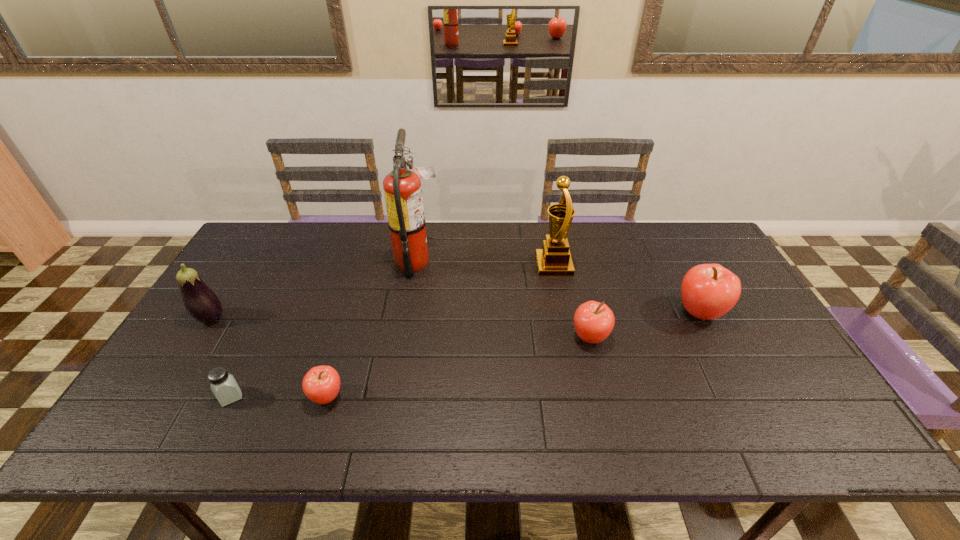
Where is `free space between the second tallest apple and the eggplant`? This screenshot has width=960, height=540. free space between the second tallest apple and the eggplant is located at coordinates (400, 328).

The image size is (960, 540). Identify the location of vacant space that is in between the saltshaker and the eggplant. (221, 357).

Where is `object that stands as the third closest to the award`? Image resolution: width=960 pixels, height=540 pixels. object that stands as the third closest to the award is located at coordinates (402, 188).

Find the location of a particular element. object that is the third closest to the rightmost apple is located at coordinates (402, 188).

The image size is (960, 540). I want to click on the closest apple to the tallest apple, so coord(593,321).

You are a GUI agent. You are given a task and a screenshot of the screen. Output one action in this format:
    pyautogui.click(x=<x>, y=<y>)
    Task: Click on the apple that stands as the third closest to the award
    This screenshot has width=960, height=540.
    Given the screenshot: What is the action you would take?
    pyautogui.click(x=321, y=384)

The image size is (960, 540). In order to click on free spot that satisfies the following two spatial constraints: 1. from the nozzle of the tallest object; 2. on the front side of the shortest apple in this screenshot , I will do `click(395, 397)`.

I want to click on vacant area in the image that satisfies the following two spatial constraints: 1. from the nozzle of the tallest apple; 2. on the right side of the tallest object, so click(409, 313).

Identify the location of blank space that satisfies the following two spatial constraints: 1. on the back side of the rightmost apple; 2. on the front-facing side of the sixth shortest object. The height and width of the screenshot is (540, 960). (675, 266).

Locate an element on the screen. vacant space that satisfies the following two spatial constraints: 1. on the back side of the fifth object from right to left; 2. on the right side of the third shortest object is located at coordinates (345, 338).